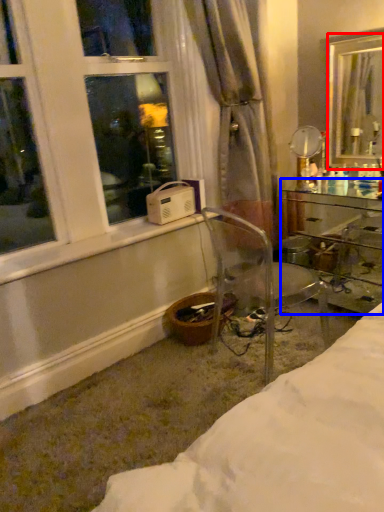
Question: Which point is closer to the camera, mirror (highlighted by a red box) or desk (highlighted by a blue box)?

Choices:
 (A) mirror
 (B) desk

Answer: (B)